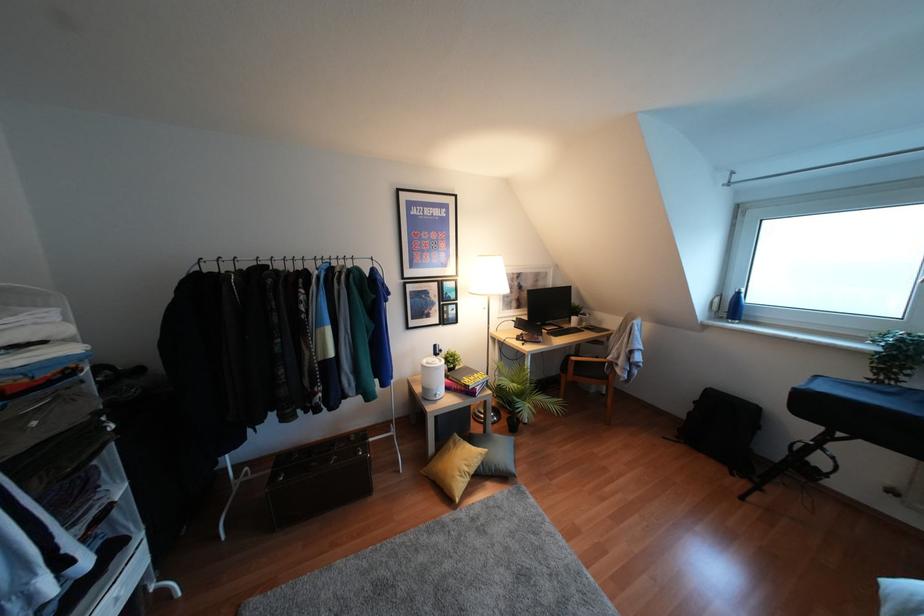
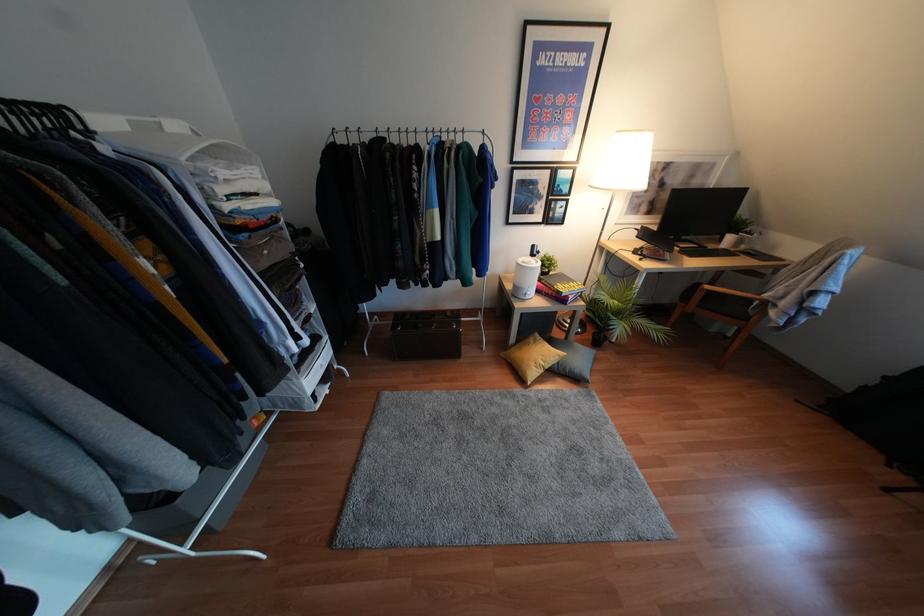
Find the pixel in the second image that matches pixel 475 374 in the first image.

(570, 283)